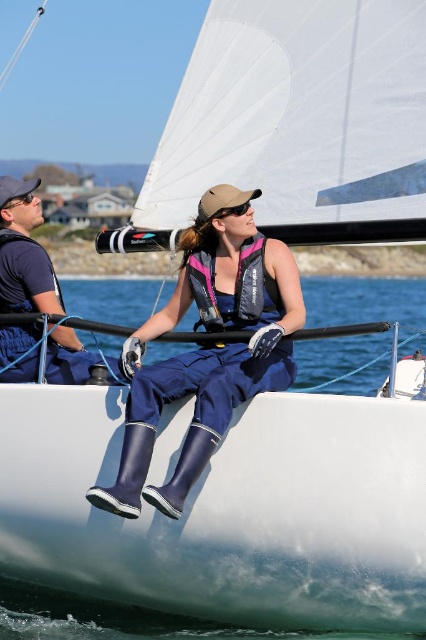
Looking at this image, does navy rubber boots at center come behind matte black camera at left?

Yes, navy rubber boots at center is further from the viewer.

Does navy rubber boots at center have a greater width compared to matte black camera at left?

→ No.

Find the location of a particular element. navy rubber boots at center is located at coordinates (207, 348).